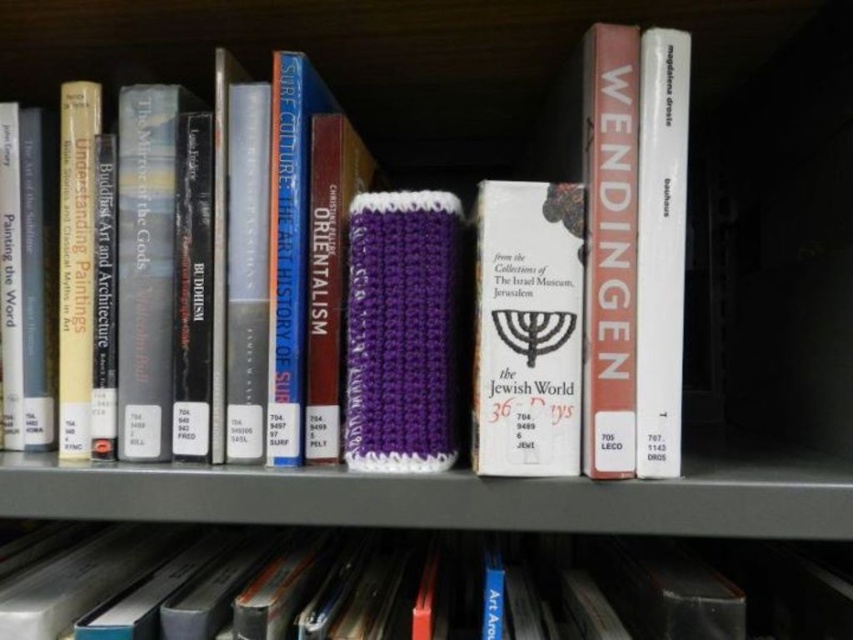
Is point (621, 582) less distant than point (560, 260)?

No, (621, 582) is further to viewer.

Which is more to the left, hardcover book at center or white paper book at center?

hardcover book at center is more to the left.

Does point (811, 605) come farther from viewer compared to point (567, 232)?

Yes, it is behind point (567, 232).

You are a GUI agent. You are given a task and a screenshot of the screen. Output one action in this format:
    pyautogui.click(x=<x>, y=<y>)
    Task: Click on the hardcover book at center
    
    Given the screenshot: What is the action you would take?
    point(412,586)

Can you confirm if matte red book at center is bigger than white paper book at right?

Indeed, matte red book at center has a larger size compared to white paper book at right.

How far apart are matte red book at center and white paper book at right?

They are 0.67 inches apart.

Between point (614, 308) and point (683, 220), which one is positioned in front?

Point (614, 308) is in front.

Identify the location of matte red book at center. (608, 250).

Does white paper book at center appear over purple knitted sleeve at center?

Indeed, white paper book at center is positioned over purple knitted sleeve at center.

Is white paper book at center further to camera compared to purple knitted sleeve at center?

That is False.

The image size is (853, 640). What do you see at coordinates (527, 328) in the screenshot?
I see `white paper book at center` at bounding box center [527, 328].

Where is `white paper book at center`? Image resolution: width=853 pixels, height=640 pixels. white paper book at center is located at coordinates (527, 328).